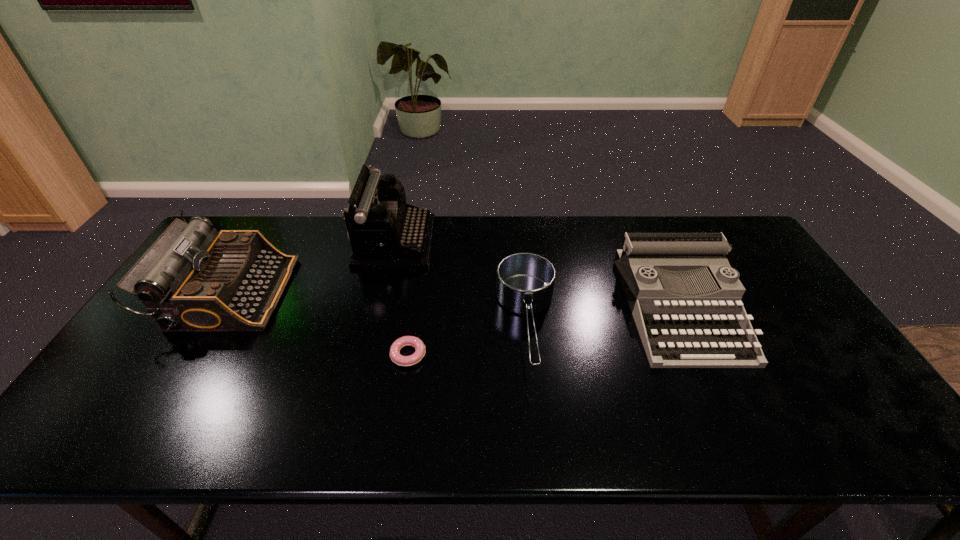
Locate an element on the screen. vacant space situated on the keyboard of the second shortest typewriter is located at coordinates (375, 293).

Locate an element on the screen. Image resolution: width=960 pixels, height=540 pixels. free region located 0.130m on the typing side of the rightmost object is located at coordinates (730, 414).

Identify the location of free region located 0.060m with the handle extending from one side of the fourth tallest object. This screenshot has height=540, width=960. (536, 405).

This screenshot has height=540, width=960. I want to click on blank space located on the left of the shortest object, so click(368, 355).

You are a GUI agent. You are given a task and a screenshot of the screen. Output one action in this format:
    pyautogui.click(x=<x>, y=<y>)
    Task: Click on the object that is at the left edge
    This screenshot has height=540, width=960.
    Given the screenshot: What is the action you would take?
    pyautogui.click(x=192, y=279)

This screenshot has width=960, height=540. In order to click on object that is at the far left corner in this screenshot , I will do `click(192, 279)`.

Where is `free space at the far edge of the desktop`? free space at the far edge of the desktop is located at coordinates (623, 238).

In the image, there is a desktop. What are the coordinates of `blank space at the near edge` in the screenshot? It's located at 569,420.

Where is `free space at the left edge of the desktop`? This screenshot has width=960, height=540. free space at the left edge of the desktop is located at coordinates (190, 349).

Identify the location of free space at the near left corner. (121, 422).